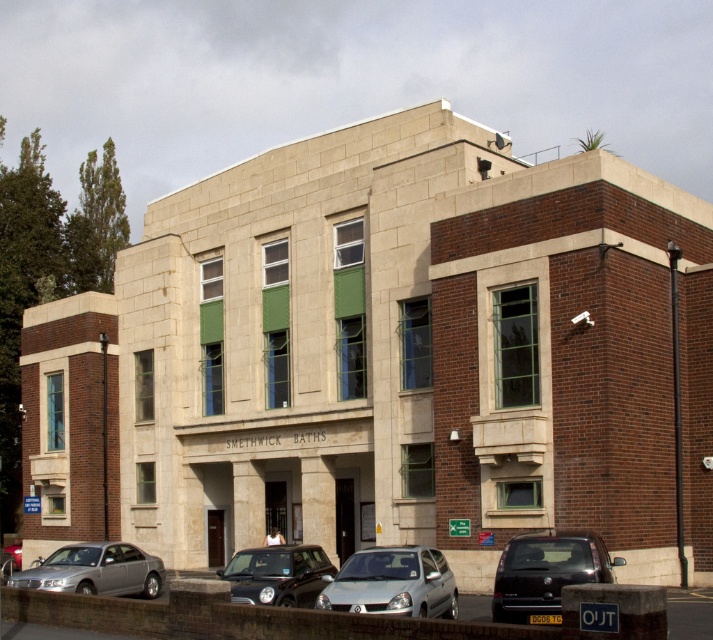
Measure the distance between silver metallic sedan at lower left and camera.

A distance of 87.37 feet exists between silver metallic sedan at lower left and camera.

Can you confirm if silver metallic sedan at lower left is bigger than shiny black car at center?

Indeed, silver metallic sedan at lower left has a larger size compared to shiny black car at center.

Image resolution: width=713 pixels, height=640 pixels. I want to click on silver metallic sedan at lower left, so click(96, 570).

At what (x,y) coordinates should I click in order to perform the action: click on silver metallic hatchback at center. Please return your answer as a coordinate pair (x, y). This screenshot has width=713, height=640. Looking at the image, I should click on (394, 582).

Between silver metallic hatchback at center and silver metallic sedan at lower left, which one is positioned higher?

silver metallic hatchback at center

Who is more forward, (409, 598) or (15, 579)?

Point (409, 598)

Where is `silver metallic hatchback at center`? This screenshot has width=713, height=640. silver metallic hatchback at center is located at coordinates (394, 582).

In the scene shown: Between dark gray metallic van at lower right and silver metallic hatchback at center, which one has more height?

Standing taller between the two is silver metallic hatchback at center.

Which is above, dark gray metallic van at lower right or silver metallic hatchback at center?

Positioned higher is dark gray metallic van at lower right.

Between point (597, 579) and point (424, 593), which one is positioned behind?

Point (424, 593)

The width and height of the screenshot is (713, 640). In order to click on dark gray metallic van at lower right in this screenshot , I will do `click(545, 572)`.